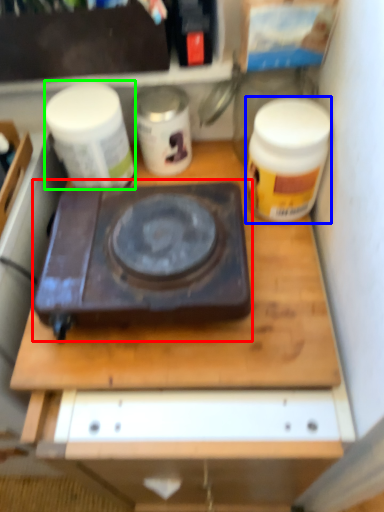
Question: Considering the real-world distances, which object is closest to gas stove (highlighted by a red box)? kitchen appliance (highlighted by a blue box) or yoghurt (highlighted by a green box).

Choices:
 (A) kitchen appliance
 (B) yoghurt

Answer: (B)